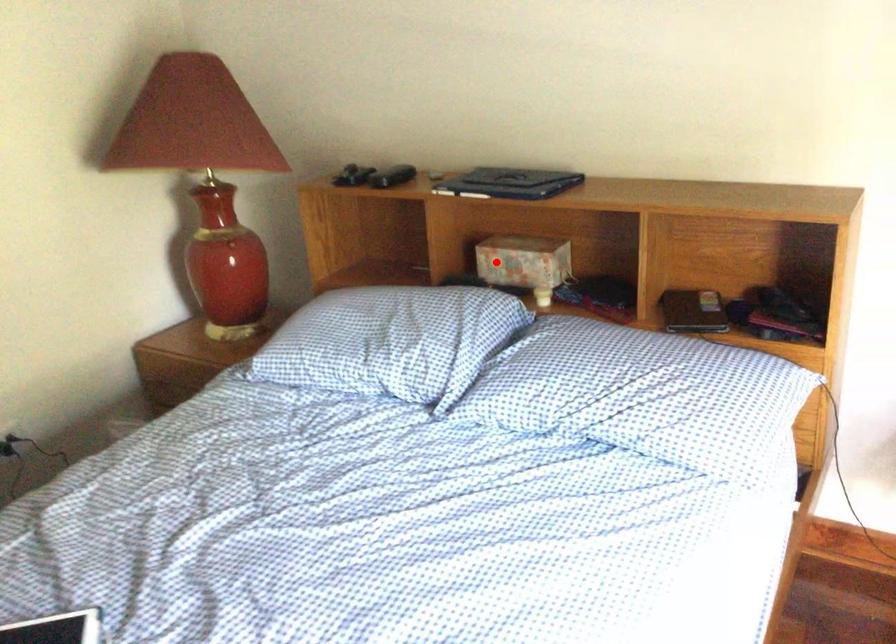
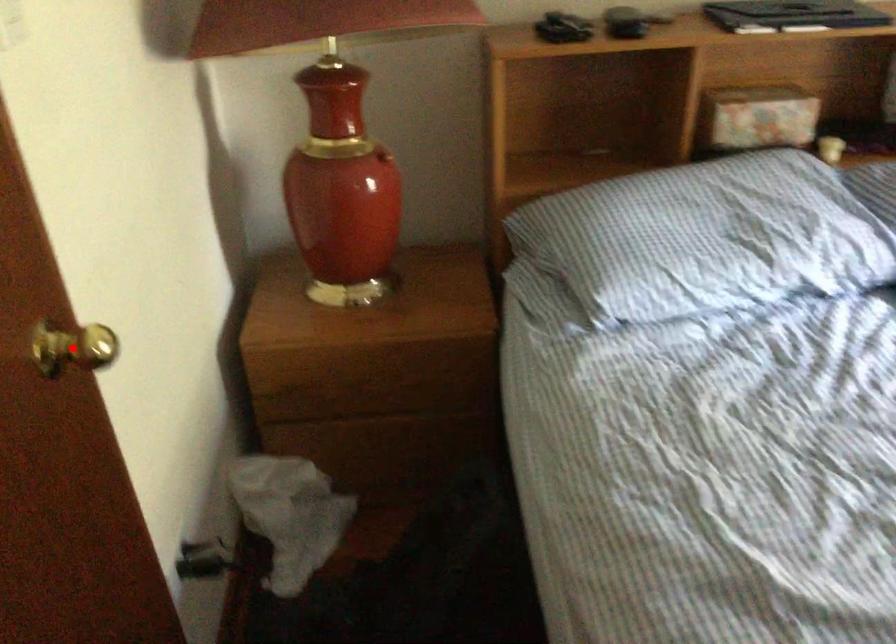
I am providing you with two images of the same scene from different viewpoints. A red point is marked on the first image and another point is marked on the second image. Are the points marked in image1 and image2 representing the same 3D position?

No